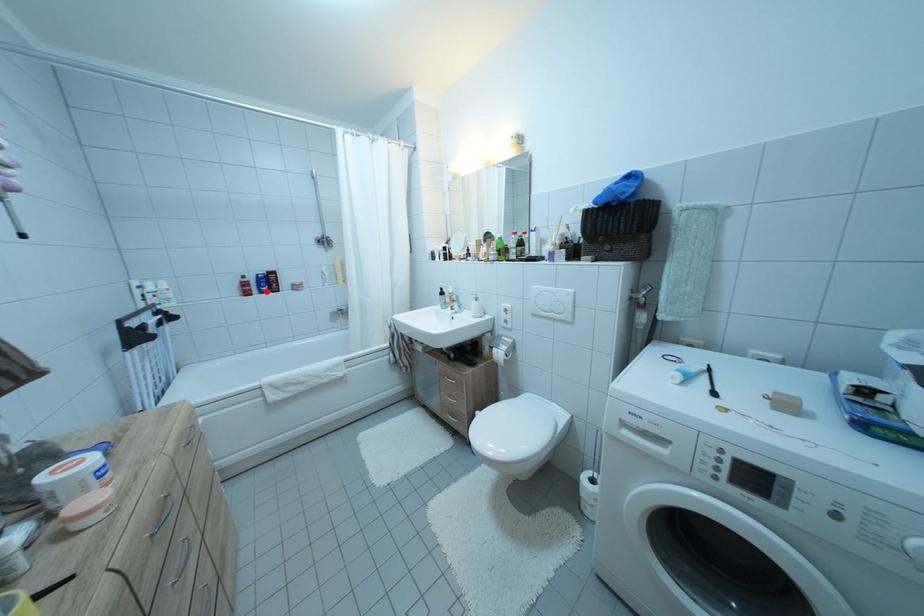
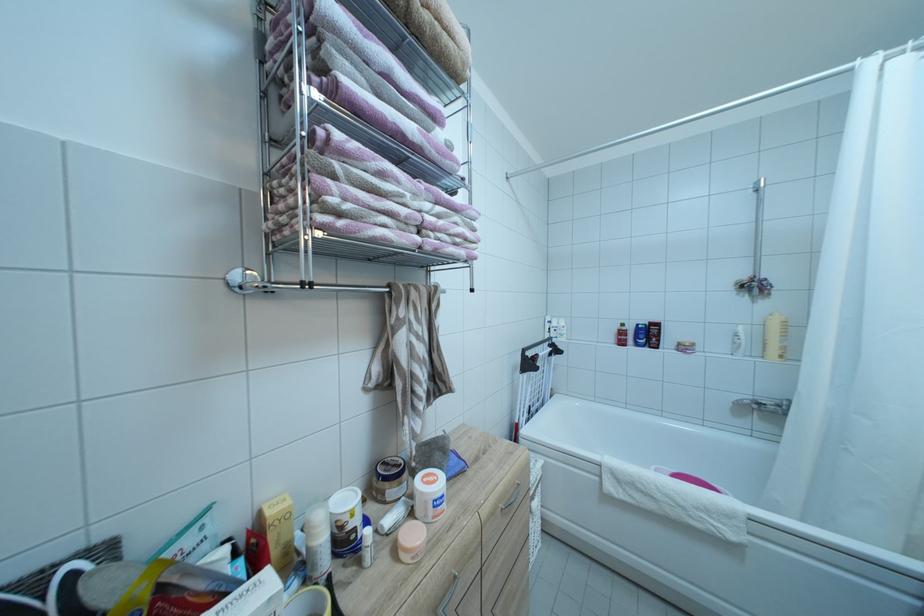
Question: I am providing you with two images of the same scene from different viewpoints. A red point is marked on the first image. Is the red point's position out of view in image 2?

Choices:
 (A) Yes
 (B) No

Answer: (B)